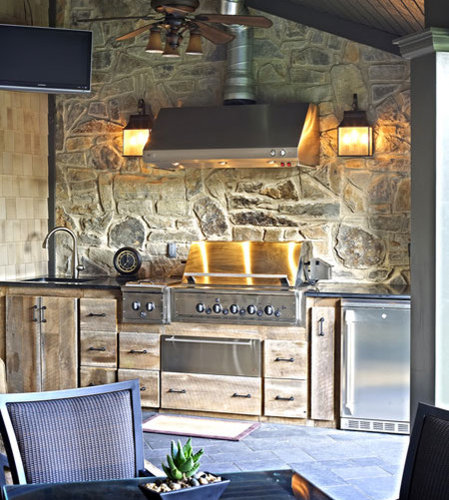
Find the location of a particular element. vent is located at coordinates (217, 126).